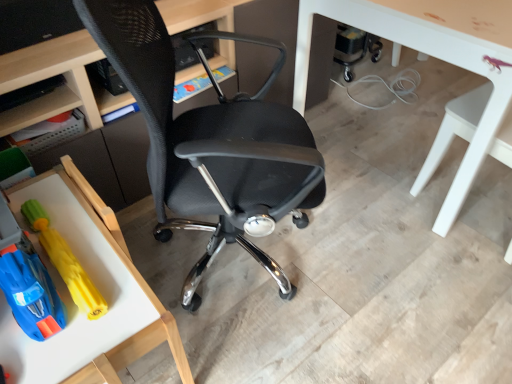
You are a GUI agent. You are given a task and a screenshot of the screen. Output one action in this format:
    pyautogui.click(x=<x>, y=<y>)
    Task: Click on the free space to the left of white glossy table at right, which ranks as the first chair in right-to-left order
    
    Given the screenshot: What is the action you would take?
    pyautogui.click(x=385, y=236)